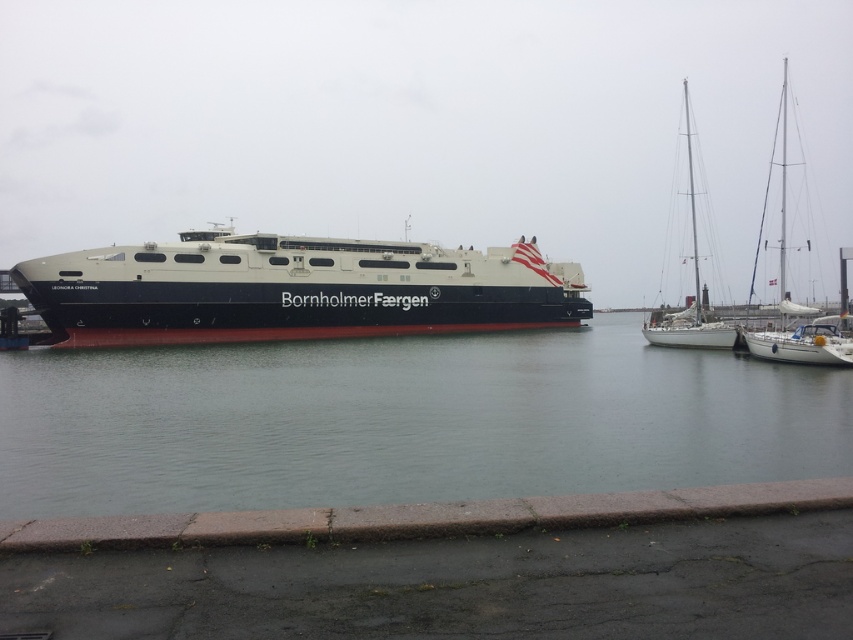
Question: Does clear water at center appear on the left side of white glossy sailboat at right?

Choices:
 (A) no
 (B) yes

Answer: (B)

Question: Which object appears farthest from the camera in this image?

Choices:
 (A) clear water at center
 (B) white glossy sailboat at right
 (C) white matte sailboat at right

Answer: (C)

Question: Which object is farther from the camera taking this photo?

Choices:
 (A) dark gray matte ferry at center
 (B) clear water at center
 (C) white glossy sailboat at right
 (D) white matte sailboat at right

Answer: (A)

Question: Is dark gray matte ferry at center positioned behind white matte sailboat at right?

Choices:
 (A) yes
 (B) no

Answer: (A)

Question: Estimate the real-world distances between objects in this image. Which object is closer to the white matte sailboat at right?

Choices:
 (A) white glossy sailboat at right
 (B) clear water at center
 (C) dark gray matte ferry at center

Answer: (A)

Question: Can you confirm if dark gray matte ferry at center is smaller than white matte sailboat at right?

Choices:
 (A) no
 (B) yes

Answer: (B)